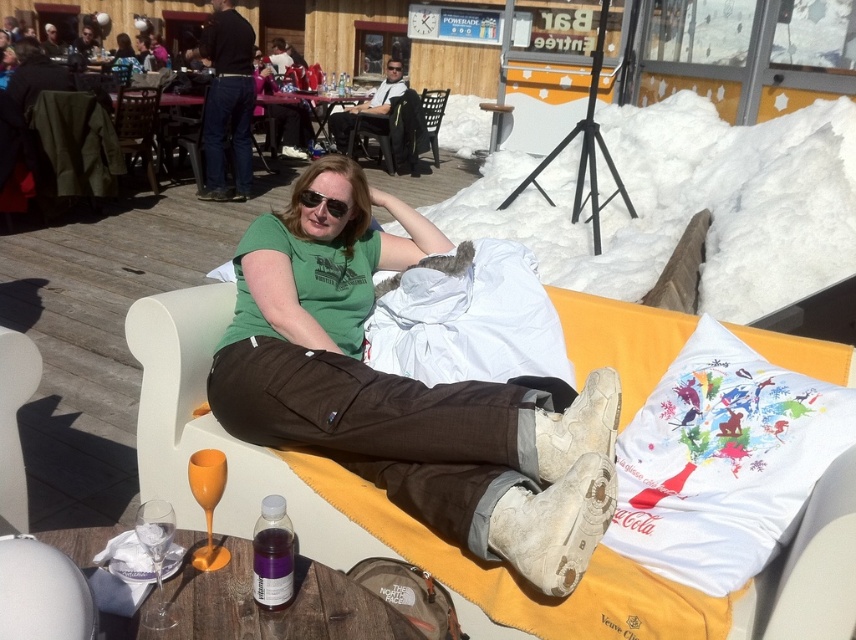
Based on the photo, can you confirm if white fabric pillow at lower right is thinner than black plastic sunglasses at center?

Incorrect, white fabric pillow at lower right's width is not less than black plastic sunglasses at center's.

Does white fabric pillow at lower right have a greater height compared to black plastic sunglasses at center?

Yes.

Between point (803, 444) and point (306, 202), which one is positioned in front?

Point (803, 444)

Where is `white fabric pillow at lower right`? This screenshot has height=640, width=856. white fabric pillow at lower right is located at coordinates (722, 461).

Is green cotton shirt at center positioned behind black plastic sunglasses at center?

That is False.

Which of these two, green cotton shirt at center or black plastic sunglasses at center, stands taller?

green cotton shirt at center is taller.

Between point (431, 497) and point (343, 205), which one is positioned in front?

Positioned in front is point (431, 497).

Find the location of a particular element. The height and width of the screenshot is (640, 856). green cotton shirt at center is located at coordinates (407, 392).

What do you see at coordinates (407, 392) in the screenshot? I see `green cotton shirt at center` at bounding box center [407, 392].

Can you confirm if green cotton shirt at center is shorter than white fabric pillow at lower right?

No, green cotton shirt at center is not shorter than white fabric pillow at lower right.

Is point (400, 268) positioned after point (806, 442)?

Yes, point (400, 268) is behind point (806, 442).

You are a GUI agent. You are given a task and a screenshot of the screen. Output one action in this format:
    pyautogui.click(x=<x>, y=<y>)
    Task: Click on the green cotton shirt at center
    The image size is (856, 640).
    Given the screenshot: What is the action you would take?
    pyautogui.click(x=407, y=392)